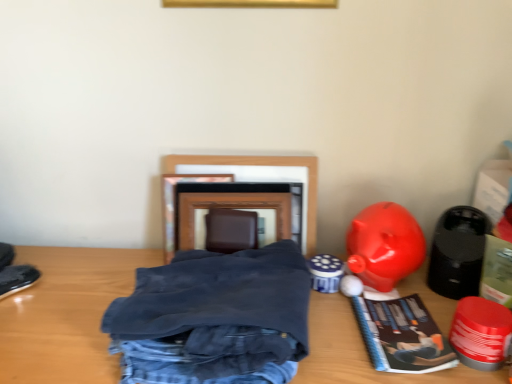
I want to click on shiny red plastic toy at lower right, the second toy from the right, so click(x=481, y=333).

Image resolution: width=512 pixels, height=384 pixels. Describe the element at coordinates (66, 314) in the screenshot. I see `wooden table at center` at that location.

The width and height of the screenshot is (512, 384). Describe the element at coordinates (258, 177) in the screenshot. I see `wooden picture frame at center` at that location.

Where is `black suede shoe at left`? The height and width of the screenshot is (384, 512). black suede shoe at left is located at coordinates (17, 279).

The width and height of the screenshot is (512, 384). In order to click on shiny red plastic toy at lower right, the second toy from the right in this screenshot , I will do `click(481, 333)`.

From the picture: Between dark blue cotton pants at center and black matte speaker at right, the 1th toy viewed from the right, which one has less height?

Standing shorter between the two is dark blue cotton pants at center.

Does dark blue cotton pants at center have a lesser width compared to black matte speaker at right, the 1th toy viewed from the right?

Incorrect, the width of dark blue cotton pants at center is not less than that of black matte speaker at right, the 1th toy viewed from the right.

Considering the positions of point (262, 257) and point (450, 213), is point (262, 257) closer or farther from the camera than point (450, 213)?

Clearly, point (262, 257) is closer to the camera than point (450, 213).

From a real-world perspective, who is located lower, dark blue cotton pants at center or black matte speaker at right, the 1th toy viewed from the right?

dark blue cotton pants at center is physically lower.

From the image's perspective, which is above, dark blue cotton pants at center or black suede shoe at left?

black suede shoe at left appears higher in the image.

Does dark blue cotton pants at center have a greater height compared to black suede shoe at left?

Correct, dark blue cotton pants at center is much taller as black suede shoe at left.

Which of these two, dark blue cotton pants at center or black suede shoe at left, is thinner?

With smaller width is black suede shoe at left.

Does shiny red plastic toy at lower right, the second toy viewed from the left, have a smaller size compared to shiny plastic piggy bank at right, which is counted as the third toy, starting from the right?

Yes.

Is shiny red plastic toy at lower right, the second toy viewed from the left, situated inside shiny plastic piggy bank at right, arranged as the first toy when viewed from the left, or outside?

shiny red plastic toy at lower right, the second toy viewed from the left, cannot be found inside shiny plastic piggy bank at right, arranged as the first toy when viewed from the left.

From a real-world perspective, which toy is the 2nd one above the shiny red plastic toy at lower right, the second toy from the right? Please provide its 2D coordinates.

[(384, 245)]

Is shiny red plastic toy at lower right, the second toy viewed from the left, next to shiny plastic piggy bank at right, which is counted as the third toy, starting from the right, and touching it?

shiny red plastic toy at lower right, the second toy viewed from the left, is not next to shiny plastic piggy bank at right, which is counted as the third toy, starting from the right, and they're not touching.

Is the surface of shiny plastic piggy bank at right, arranged as the first toy when viewed from the left, in direct contact with matte paper book at lower right?

No, shiny plastic piggy bank at right, arranged as the first toy when viewed from the left, is not beside matte paper book at lower right.

Which is more to the left, shiny plastic piggy bank at right, arranged as the first toy when viewed from the left, or matte paper book at lower right?

shiny plastic piggy bank at right, arranged as the first toy when viewed from the left.

Is shiny plastic piggy bank at right, arranged as the first toy when viewed from the left, facing towards matte paper book at lower right?

No, shiny plastic piggy bank at right, arranged as the first toy when viewed from the left, is not aimed at matte paper book at lower right.

How different are the orientations of black suede shoe at left and wooden table at center in degrees?

The angle between the facing direction of black suede shoe at left and the facing direction of wooden table at center is 42.5 degrees.

Is black suede shoe at left to the left or to the right of wooden table at center in the image?

Based on their positions, black suede shoe at left is located to the left of wooden table at center.

What are the coordinates of `table below the black suede shoe at left (from the image's perspective)` in the screenshot? It's located at (66, 314).

Considering the relative sizes of black suede shoe at left and wooden table at center in the image provided, is black suede shoe at left smaller than wooden table at center?

Correct, black suede shoe at left occupies less space than wooden table at center.

Is matte paper book at lower right next to black suede shoe at left and touching it?

No, matte paper book at lower right is not touching black suede shoe at left.

From a real-world perspective, is matte paper book at lower right positioned over black suede shoe at left based on gravity?

No, from a real-world perspective, matte paper book at lower right is not over black suede shoe at left

Who is more distant, matte paper book at lower right or black suede shoe at left?

black suede shoe at left is further away from the camera.

Considering the sizes of objects matte paper book at lower right and shiny plastic piggy bank at right, which is counted as the third toy, starting from the right, in the image provided, who is wider, matte paper book at lower right or shiny plastic piggy bank at right, which is counted as the third toy, starting from the right,?

With larger width is matte paper book at lower right.

Is matte paper book at lower right located outside shiny plastic piggy bank at right, arranged as the first toy when viewed from the left?

matte paper book at lower right is positioned outside shiny plastic piggy bank at right, arranged as the first toy when viewed from the left.

Locate an element on the screen. This screenshot has height=384, width=512. book that is on the right side of shiny plastic piggy bank at right, which is counted as the third toy, starting from the right is located at coordinates (402, 336).

Looking at this image, considering the relative sizes of matte paper book at lower right and shiny plastic piggy bank at right, which is counted as the third toy, starting from the right, in the image provided, is matte paper book at lower right bigger than shiny plastic piggy bank at right, which is counted as the third toy, starting from the right,?

Actually, matte paper book at lower right might be smaller than shiny plastic piggy bank at right, which is counted as the third toy, starting from the right.

Find the location of `the 3rd toy behind the dark blue cotton pants at center, counting from the anchor's position`. the 3rd toy behind the dark blue cotton pants at center, counting from the anchor's position is located at coordinates (458, 252).

This screenshot has height=384, width=512. Find the location of `footwear that appears above the dark blue cotton pants at center (from the image's perspective)`. footwear that appears above the dark blue cotton pants at center (from the image's perspective) is located at coordinates (17, 279).

Considering their positions, is matte paper book at lower right positioned further to dark blue cotton pants at center than shiny red plastic toy at lower right, the second toy viewed from the left?

The object further to dark blue cotton pants at center is shiny red plastic toy at lower right, the second toy viewed from the left.

Based on their spatial positions, is shiny red plastic toy at lower right, the second toy from the right, or wooden table at center further from dark blue cotton pants at center?

shiny red plastic toy at lower right, the second toy from the right, is positioned further to the anchor dark blue cotton pants at center.

When comparing their distances from matte paper book at lower right, does black suede shoe at left or wooden table at center seem further?

The object further to matte paper book at lower right is black suede shoe at left.

From the image, which object appears to be nearer to wooden table at center, wooden picture frame at center or shiny plastic piggy bank at right, arranged as the first toy when viewed from the left?

Based on the image, wooden picture frame at center appears to be nearer to wooden table at center.

When comparing their distances from matte paper book at lower right, does wooden picture frame at center or dark blue cotton pants at center seem further?

Among the two, wooden picture frame at center is located further to matte paper book at lower right.

Estimate the real-world distances between objects in this image. Which object is further from shiny red plastic toy at lower right, the second toy from the right, wooden table at center or matte paper book at lower right?

Among the two, wooden table at center is located further to shiny red plastic toy at lower right, the second toy from the right.

Which object lies nearer to the anchor point shiny plastic piggy bank at right, arranged as the first toy when viewed from the left, shiny red plastic toy at lower right, the second toy viewed from the left, or wooden picture frame at center?

shiny red plastic toy at lower right, the second toy viewed from the left, is closer to shiny plastic piggy bank at right, arranged as the first toy when viewed from the left.

Estimate the real-world distances between objects in this image. Which object is further from wooden picture frame at center, shiny plastic piggy bank at right, which is counted as the third toy, starting from the right, or black suede shoe at left?

The object further to wooden picture frame at center is black suede shoe at left.

Image resolution: width=512 pixels, height=384 pixels. I want to click on picture frame between black suede shoe at left and shiny plastic piggy bank at right, which is counted as the third toy, starting from the right, from left to right, so click(x=258, y=177).

What are the coordinates of `book located between shiny plastic piggy bank at right, which is counted as the third toy, starting from the right, and black matte speaker at right, acting as the third toy starting from the left, in the left-right direction` in the screenshot? It's located at (402, 336).

This screenshot has width=512, height=384. Identify the location of clothing between wooden table at center and shiny red plastic toy at lower right, the second toy from the right, in the horizontal direction. (214, 318).

Locate an element on the screen. toy between black suede shoe at left and shiny red plastic toy at lower right, the second toy viewed from the left, in the horizontal direction is located at coordinates (384, 245).